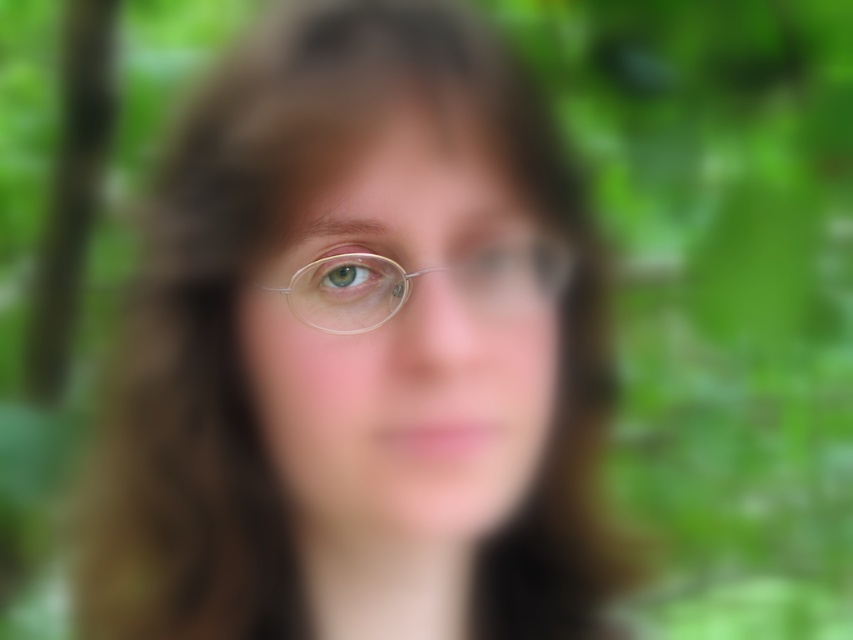
You are a photographer adjusting your camera settings to capture a close portrait. You notice the matte gold glasses at center are positioned at a certain distance from the viewer. Based on standard camera focus ranges, can you determine if the glasses will be in focus if your camera is set to auto focus on objects 18 inches away?

The matte gold glasses at center is 17.70 inches from viewer, which is very close to the 18 inches auto focus setting. Depending on the camera lens and depth of field, it might be in focus but slightly out of sharp focus due to the minor distance difference.

Looking at this image, you are holding a camera and want to take a photo of the scene described. If you move the camera 5 inches closer to the point at point (321, 296), what will happen to the focus of the image?

Moving the camera 5 inches closer to the point at point (321, 296) would reduce the distance to 13.68 inches. Since the original focus was set for 18.68 inches, the image may become out of focus unless the focus is adjusted to the new distance.